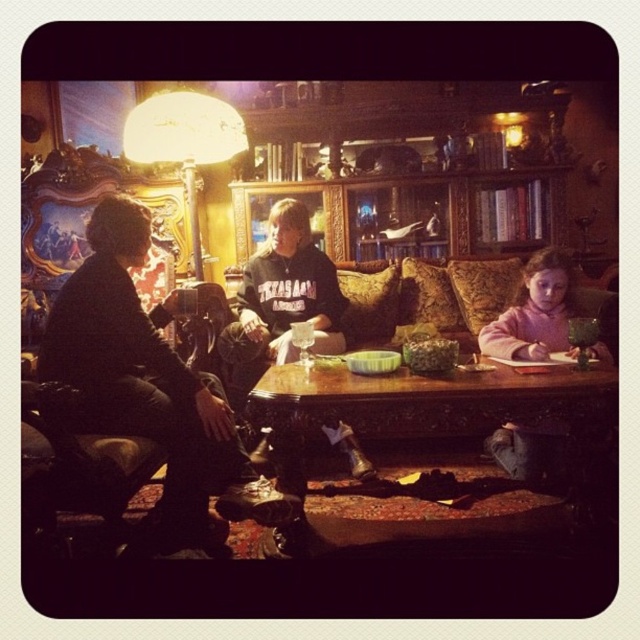
You are trying to place the dark brown leather jacket at left on the wooden table at center. Can it fit on the table based on their sizes?

The dark brown leather jacket at left is narrower than the wooden table at center, so it can fit on the table.

You are standing in the living room and want to place a 1.5 meter long sofa against the wall behind the wooden table at center. Can you fit the sofa there if the wall is 2 meters wide?

The distance between the wooden table at center and the viewer is 1.60 meters, but the question is about the width of the wall behind the table. Since the wall is 2 meters wide and the sofa is 1.5 meters long, the sofa will fit as 1.5 is less than 2.

You are a delivery person who needs to place a package between the dark brown leather jacket at left and the pink fleece sweater at lower right. The package is 1 meter long. Can you fit it between them without moving either item?

The distance between the dark brown leather jacket at left and the pink fleece sweater at lower right is 1.10 meters. Since the package is 1 meter long, it can fit comfortably between them without needing to move either item.